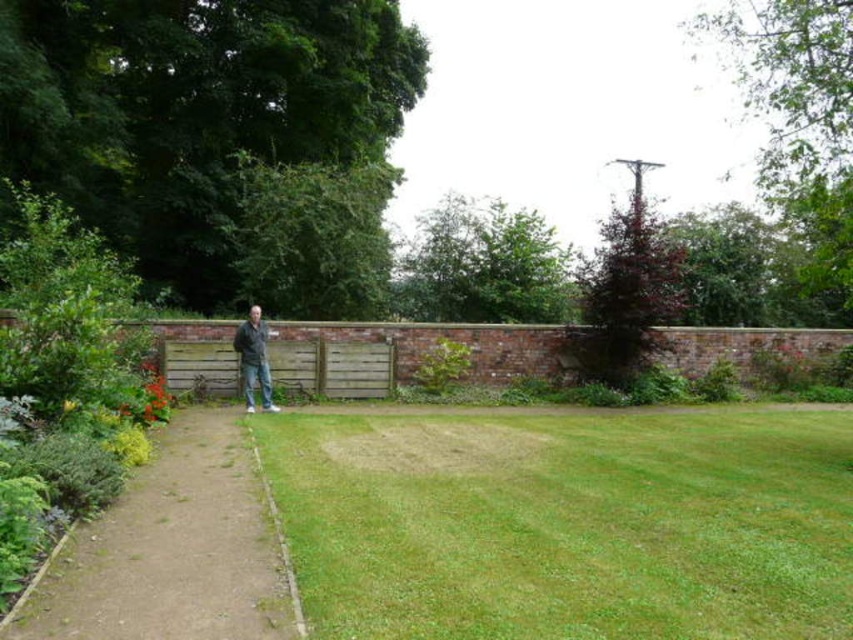
Question: Can you confirm if green grass at center is smaller than dark gray jacket at center?

Choices:
 (A) no
 (B) yes

Answer: (A)

Question: Considering the relative positions of green grass at center and brick wall at center in the image provided, where is green grass at center located with respect to brick wall at center?

Choices:
 (A) below
 (B) above

Answer: (A)

Question: Among these objects, which one is nearest to the camera?

Choices:
 (A) dirt/gravel path at center-left
 (B) green grass at center
 (C) brick wall at center
 (D) dark gray jacket at center

Answer: (B)

Question: Is green grass at center above brick wall at center?

Choices:
 (A) yes
 (B) no

Answer: (B)

Question: Which point is farther from the camera taking this photo?

Choices:
 (A) (674, 326)
 (B) (141, 522)
 (C) (476, 609)

Answer: (A)

Question: Which object appears closest to the camera in this image?

Choices:
 (A) dark gray jacket at center
 (B) brick wall at center
 (C) green grass at center

Answer: (C)